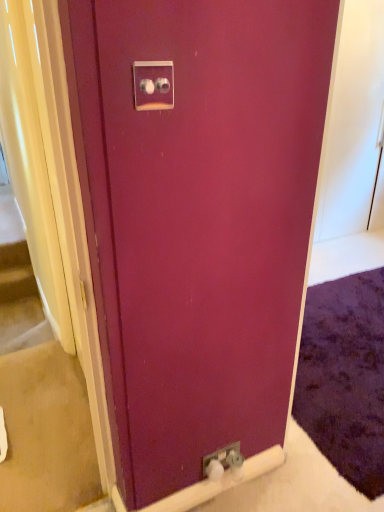
The height and width of the screenshot is (512, 384). I want to click on satin silver switch at upper center, which is counted as the second electric outlet, starting from the back, so click(153, 85).

The width and height of the screenshot is (384, 512). Describe the element at coordinates (153, 85) in the screenshot. I see `satin silver switch at upper center, which is counted as the second electric outlet, starting from the back` at that location.

I want to click on beige carpet at lower left, so click(x=39, y=394).

Image resolution: width=384 pixels, height=512 pixels. Describe the element at coordinates (221, 456) in the screenshot. I see `metallic silver outlet at lower center, marked as the first electric outlet in a right-to-left arrangement` at that location.

Identify the location of satin silver switch at upper center, which ranks as the second electric outlet in right-to-left order. (153, 85).

Considering the sizes of beige carpet at lower left and satin silver switch at upper center, the second electric outlet from the bottom, in the image, is beige carpet at lower left bigger or smaller than satin silver switch at upper center, the second electric outlet from the bottom,?

beige carpet at lower left is bigger than satin silver switch at upper center, the second electric outlet from the bottom.

From the picture: Does beige carpet at lower left appear on the right side of satin silver switch at upper center, which ranks as the second electric outlet in right-to-left order?

In fact, beige carpet at lower left is to the left of satin silver switch at upper center, which ranks as the second electric outlet in right-to-left order.

Is beige carpet at lower left beside satin silver switch at upper center, marked as the first electric outlet in a left-to-right arrangement?

No.

Who is taller, beige carpet at lower left or satin silver switch at upper center, which ranks as the second electric outlet in right-to-left order?

satin silver switch at upper center, which ranks as the second electric outlet in right-to-left order.

Can you tell me how much satin silver switch at upper center, positioned as the 1th electric outlet in front-to-back order, and beige carpet at lower left differ in facing direction?

2.88 degrees.

Is beige carpet at lower left a part of satin silver switch at upper center, which ranks as the second electric outlet in right-to-left order?

No, beige carpet at lower left is not a part of satin silver switch at upper center, which ranks as the second electric outlet in right-to-left order.

Is satin silver switch at upper center, which is counted as the second electric outlet, starting from the back, bigger or smaller than beige carpet at lower left?

Considering their sizes, satin silver switch at upper center, which is counted as the second electric outlet, starting from the back, takes up less space than beige carpet at lower left.

Based on the photo, is satin silver switch at upper center, which is counted as the second electric outlet, starting from the back, at the right side of beige carpet at lower left?

Yes.

Which is more to the right, metallic silver outlet at lower center, which is counted as the 2th electric outlet, starting from the top, or beige carpet at lower left?

From the viewer's perspective, metallic silver outlet at lower center, which is counted as the 2th electric outlet, starting from the top, appears more on the right side.

Is metallic silver outlet at lower center, acting as the 2th electric outlet starting from the left, positioned beyond the bounds of beige carpet at lower left?

That's correct, metallic silver outlet at lower center, acting as the 2th electric outlet starting from the left, is outside of beige carpet at lower left.

From the picture: Who is bigger, metallic silver outlet at lower center, marked as the first electric outlet in a right-to-left arrangement, or beige carpet at lower left?

beige carpet at lower left is bigger.

From the image's perspective, is metallic silver outlet at lower center, acting as the 2th electric outlet starting from the left, above or below beige carpet at lower left?

Clearly, from the image's perspective, metallic silver outlet at lower center, acting as the 2th electric outlet starting from the left, is below beige carpet at lower left.

Considering the relative sizes of beige carpet at lower left and metallic silver outlet at lower center, acting as the 2th electric outlet starting from the left, in the image provided, is beige carpet at lower left thinner than metallic silver outlet at lower center, acting as the 2th electric outlet starting from the left,?

No.

Can you tell me how much beige carpet at lower left and metallic silver outlet at lower center, which is counted as the 2th electric outlet, starting from the top, differ in facing direction?

The angular difference between beige carpet at lower left and metallic silver outlet at lower center, which is counted as the 2th electric outlet, starting from the top, is 1.8 degrees.

From a real-world perspective, who is located higher, beige carpet at lower left or metallic silver outlet at lower center, marked as the first electric outlet in a right-to-left arrangement?

metallic silver outlet at lower center, marked as the first electric outlet in a right-to-left arrangement, is physically above.

Based on the photo, considering the positions of objects beige carpet at lower left and metallic silver outlet at lower center, acting as the 2th electric outlet starting from the left, in the image provided, who is more to the right, beige carpet at lower left or metallic silver outlet at lower center, acting as the 2th electric outlet starting from the left,?

Positioned to the right is metallic silver outlet at lower center, acting as the 2th electric outlet starting from the left.

Considering the sizes of objects metallic silver outlet at lower center, the first electric outlet positioned from the bottom, and satin silver switch at upper center, which ranks as the second electric outlet in right-to-left order, in the image provided, who is shorter, metallic silver outlet at lower center, the first electric outlet positioned from the bottom, or satin silver switch at upper center, which ranks as the second electric outlet in right-to-left order,?

metallic silver outlet at lower center, the first electric outlet positioned from the bottom, is shorter.

Are metallic silver outlet at lower center, the 1th electric outlet viewed from the back, and satin silver switch at upper center, the second electric outlet from the bottom, far apart?

Absolutely, metallic silver outlet at lower center, the 1th electric outlet viewed from the back, is distant from satin silver switch at upper center, the second electric outlet from the bottom.

Is metallic silver outlet at lower center, marked as the first electric outlet in a right-to-left arrangement, spatially inside satin silver switch at upper center, marked as the first electric outlet in a left-to-right arrangement, or outside of it?

metallic silver outlet at lower center, marked as the first electric outlet in a right-to-left arrangement, exists outside the volume of satin silver switch at upper center, marked as the first electric outlet in a left-to-right arrangement.

From the image's perspective, is metallic silver outlet at lower center, acting as the 2th electric outlet starting from the left, located above satin silver switch at upper center, which is counted as the second electric outlet, starting from the back?

No, from the image's perspective, metallic silver outlet at lower center, acting as the 2th electric outlet starting from the left, is not over satin silver switch at upper center, which is counted as the second electric outlet, starting from the back.

From the picture: Looking at their sizes, would you say satin silver switch at upper center, the 1th electric outlet from the top, is wider or thinner than metallic silver outlet at lower center, marked as the first electric outlet in a right-to-left arrangement?

Considering their sizes, satin silver switch at upper center, the 1th electric outlet from the top, looks broader than metallic silver outlet at lower center, marked as the first electric outlet in a right-to-left arrangement.

Does satin silver switch at upper center, positioned as the 1th electric outlet in front-to-back order, appear on the left side of metallic silver outlet at lower center, the first electric outlet positioned from the bottom?

Indeed, satin silver switch at upper center, positioned as the 1th electric outlet in front-to-back order, is positioned on the left side of metallic silver outlet at lower center, the first electric outlet positioned from the bottom.

Who is more distant, satin silver switch at upper center, which is counted as the second electric outlet, starting from the back, or metallic silver outlet at lower center, the 1th electric outlet viewed from the back?

metallic silver outlet at lower center, the 1th electric outlet viewed from the back, is more distant.

Who is shorter, satin silver switch at upper center, which ranks as the second electric outlet in right-to-left order, or metallic silver outlet at lower center, the 1th electric outlet viewed from the back?

With less height is metallic silver outlet at lower center, the 1th electric outlet viewed from the back.

At what (x,y) coordinates should I click in order to perform the action: click on stairwell below the satin silver switch at upper center, the second electric outlet from the bottom (from a real-world perspective). Please return your answer as a coordinate pair (x, y). This screenshot has width=384, height=512. Looking at the image, I should click on (39, 394).

Find the location of a particular element. The width and height of the screenshot is (384, 512). stairwell lying on the left of satin silver switch at upper center, which is counted as the second electric outlet, starting from the back is located at coordinates (39, 394).

Considering their positions, is beige carpet at lower left positioned closer to metallic silver outlet at lower center, which is the second electric outlet from front to back, than satin silver switch at upper center, positioned as the 1th electric outlet in front-to-back order?

Based on the image, beige carpet at lower left appears to be nearer to metallic silver outlet at lower center, which is the second electric outlet from front to back.

In the scene shown: Based on their spatial positions, is satin silver switch at upper center, positioned as the 1th electric outlet in front-to-back order, or metallic silver outlet at lower center, acting as the 2th electric outlet starting from the left, closer to beige carpet at lower left?

metallic silver outlet at lower center, acting as the 2th electric outlet starting from the left.

Which object lies nearer to the anchor point beige carpet at lower left, metallic silver outlet at lower center, the first electric outlet positioned from the bottom, or satin silver switch at upper center, the second electric outlet from the bottom?

Based on the image, metallic silver outlet at lower center, the first electric outlet positioned from the bottom, appears to be nearer to beige carpet at lower left.

Based on their spatial positions, is satin silver switch at upper center, marked as the first electric outlet in a left-to-right arrangement, or beige carpet at lower left closer to metallic silver outlet at lower center, the first electric outlet positioned from the bottom?

The object closer to metallic silver outlet at lower center, the first electric outlet positioned from the bottom, is beige carpet at lower left.

Considering their positions, is metallic silver outlet at lower center, which is counted as the 2th electric outlet, starting from the top, positioned further to satin silver switch at upper center, the 1th electric outlet from the top, than beige carpet at lower left?

beige carpet at lower left is further to satin silver switch at upper center, the 1th electric outlet from the top.

Considering their positions, is beige carpet at lower left positioned closer to satin silver switch at upper center, which is counted as the second electric outlet, starting from the back, than metallic silver outlet at lower center, the 1th electric outlet viewed from the back?

metallic silver outlet at lower center, the 1th electric outlet viewed from the back.

Locate an element on the screen. This screenshot has width=384, height=512. stairwell that lies between satin silver switch at upper center, which ranks as the second electric outlet in right-to-left order, and metallic silver outlet at lower center, marked as the first electric outlet in a right-to-left arrangement, from top to bottom is located at coordinates (39, 394).